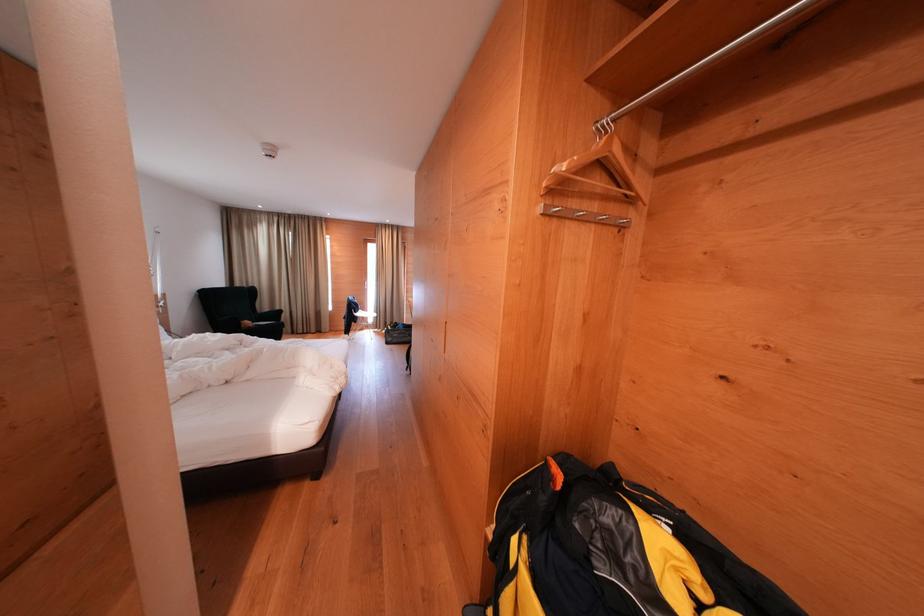
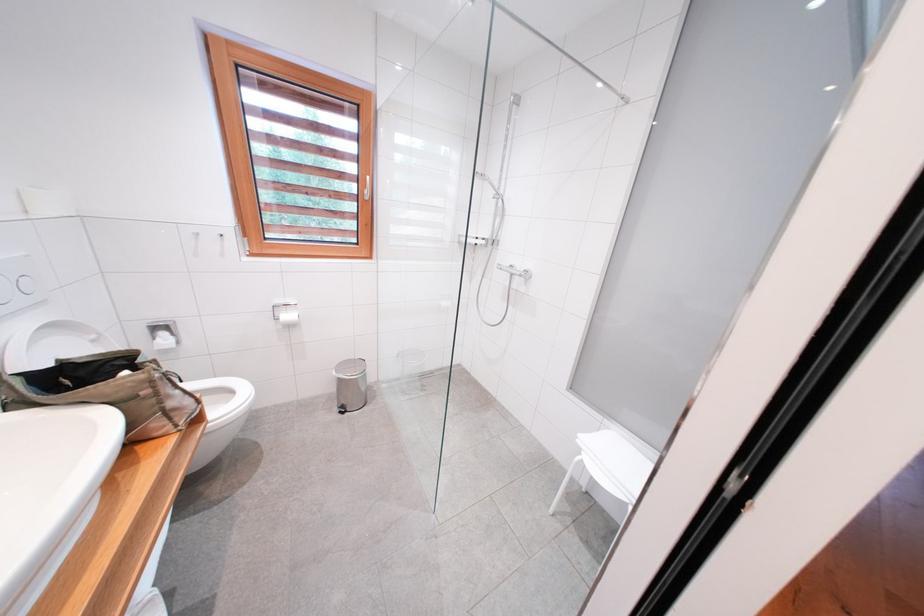
Question: The camera is either moving clockwise (left) or counter-clockwise (right) around the object. The first image is from the beginning of the video and the second image is from the end. Is the camera moving left or right when shooting the video?

Choices:
 (A) Left
 (B) Right

Answer: (B)